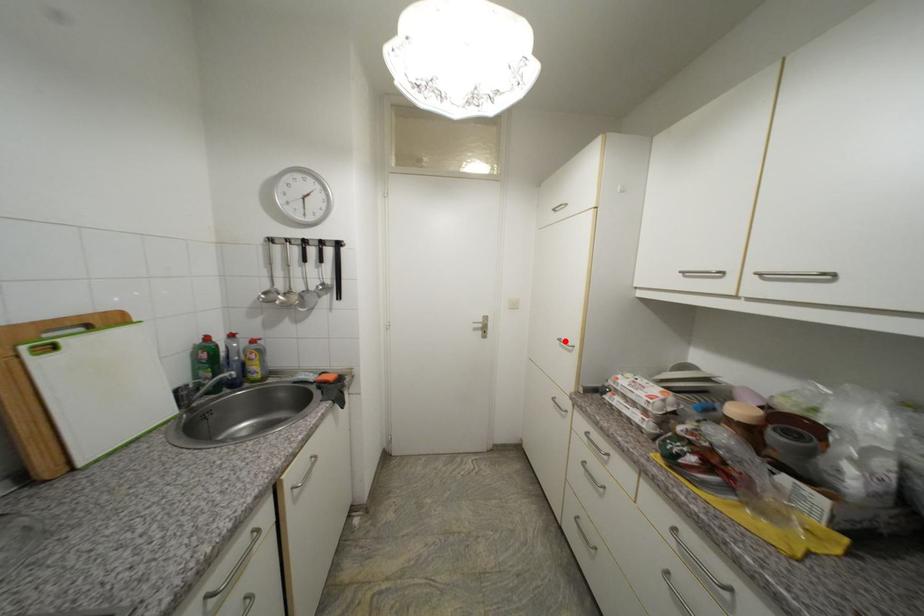
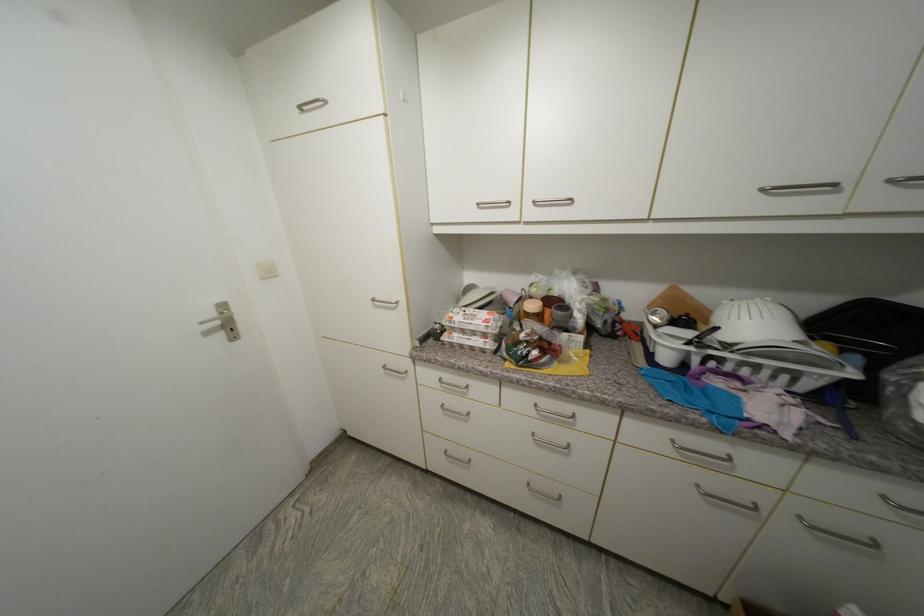
The point at the highlighted location is marked in the first image. Where is the corresponding point in the second image?

(379, 301)